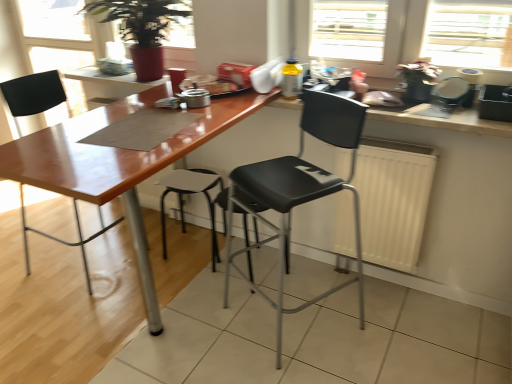
Where is `unoccupied area in front of matte black chair at left, which is the second chair from right to left`? This screenshot has height=384, width=512. unoccupied area in front of matte black chair at left, which is the second chair from right to left is located at coordinates (50, 312).